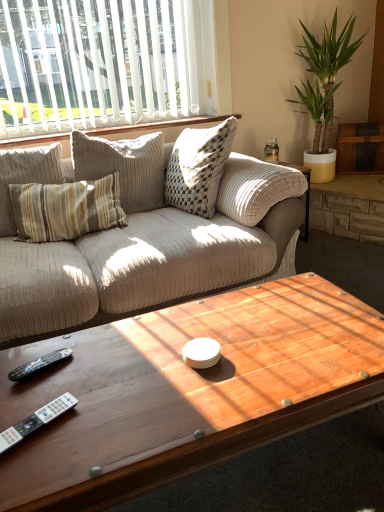
At what (x,y) coordinates should I click in order to perform the action: click on vacant area to the right of white plastic remote at lower left. Please return your answer as a coordinate pair (x, y). Looking at the image, I should click on (99, 425).